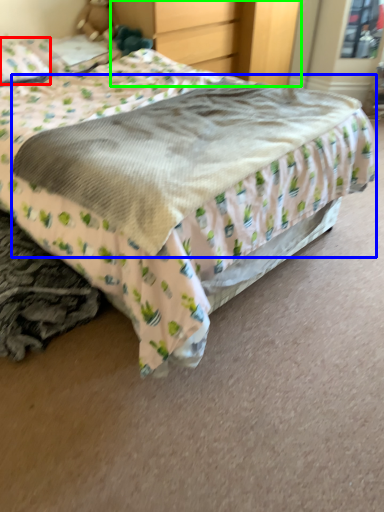
Question: Estimate the real-world distances between objects in this image. Which object is farther from pillow (highlighted by a red box), mattress (highlighted by a blue box) or dresser (highlighted by a green box)?

Choices:
 (A) mattress
 (B) dresser

Answer: (A)